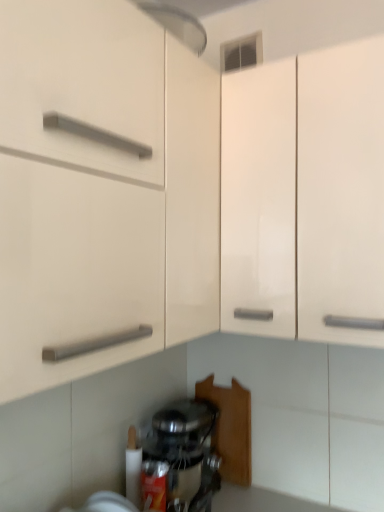
Question: Considering the positions of white glossy cabinet at center and satin silver mixer at lower center in the image, is white glossy cabinet at center taller or shorter than satin silver mixer at lower center?

Choices:
 (A) short
 (B) tall

Answer: (B)

Question: From the image's perspective, is white glossy cabinet at center above or below satin silver mixer at lower center?

Choices:
 (A) below
 (B) above

Answer: (B)

Question: Is white glossy cabinet at center situated inside satin silver mixer at lower center or outside?

Choices:
 (A) outside
 (B) inside

Answer: (A)

Question: From a real-world perspective, is satin silver mixer at lower center above or below white glossy cabinet at center?

Choices:
 (A) above
 (B) below

Answer: (B)

Question: Based on their sizes in the image, would you say satin silver mixer at lower center is bigger or smaller than white glossy cabinet at center?

Choices:
 (A) small
 (B) big

Answer: (A)

Question: From the image's perspective, is satin silver mixer at lower center located above or below white glossy cabinet at center?

Choices:
 (A) above
 (B) below

Answer: (B)

Question: In the image, is satin silver mixer at lower center on the left side or the right side of white glossy cabinet at center?

Choices:
 (A) left
 (B) right

Answer: (A)